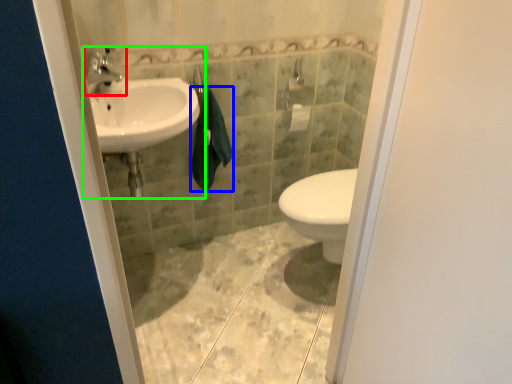
Question: Estimate the real-world distances between objects in this image. Which object is farther from tap (highlighted by a red box), bath towel (highlighted by a blue box) or sink (highlighted by a green box)?

Choices:
 (A) bath towel
 (B) sink

Answer: (A)